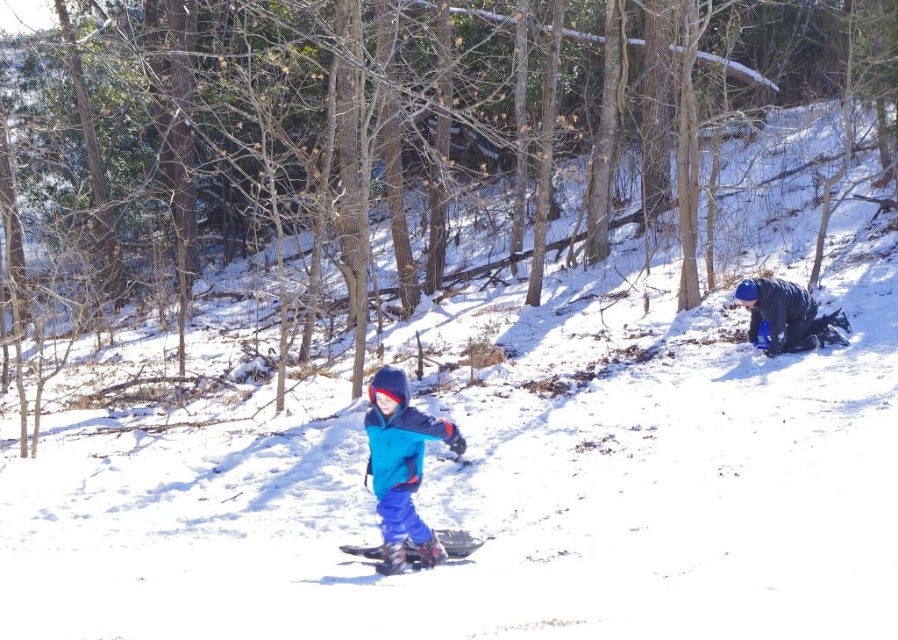
Question: Can you confirm if blue fleece snowsuit at center is thinner than blue fabric snowshoe at center?

Choices:
 (A) no
 (B) yes

Answer: (A)

Question: Is white matte snowboard at center below blue fabric snowshoe at center?

Choices:
 (A) yes
 (B) no

Answer: (A)

Question: Which object is closer to the camera taking this photo?

Choices:
 (A) white matte snowboard at center
 (B) blue fabric snowshoe at center
 (C) brown bark tree at center
 (D) blue fleece snowsuit at center

Answer: (D)

Question: Which point is closer to the camera taking this photo?

Choices:
 (A) (405, 554)
 (B) (410, 556)

Answer: (A)

Question: Considering the relative positions of brown bark tree at center and white matte snowboard at center in the image provided, where is brown bark tree at center located with respect to white matte snowboard at center?

Choices:
 (A) left
 (B) right

Answer: (B)

Question: Estimate the real-world distances between objects in this image. Which object is farther from the blue fabric snowshoe at center?

Choices:
 (A) brown bark tree at center
 (B) blue fleece snowsuit at center

Answer: (A)